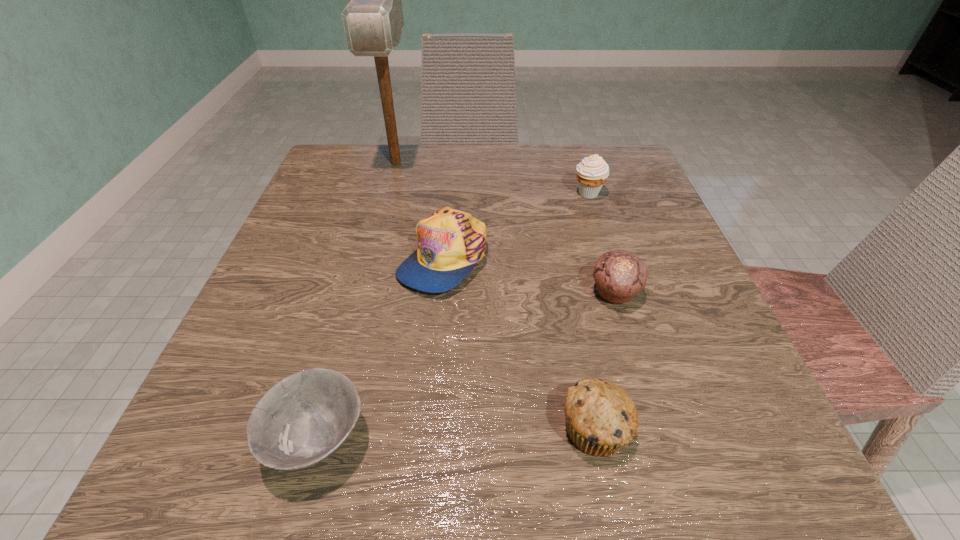
Select which object appears as the fifth closest to the nearest muffin. Please provide its 2D coordinates. Your answer should be formatted as a tuple, i.e. [(x, y)], where the tuple contains the x and y coordinates of a point satisfying the conditions above.

[(373, 20)]

The image size is (960, 540). I want to click on the third closest muffin to the farthest object, so click(x=601, y=418).

Choose which muffin is the nearest neighbor to the nearest muffin. Please provide its 2D coordinates. Your answer should be formatted as a tuple, i.e. [(x, y)], where the tuple contains the x and y coordinates of a point satisfying the conditions above.

[(619, 275)]

Find the location of a particular element. Image resolution: width=960 pixels, height=540 pixels. free point that satisfies the following two spatial constraints: 1. on the back side of the bowl; 2. on the right side of the nearest muffin is located at coordinates (321, 429).

Identify the location of free spot that satisfies the following two spatial constraints: 1. on the back side of the bowl; 2. on the right side of the second nearest muffin. (358, 293).